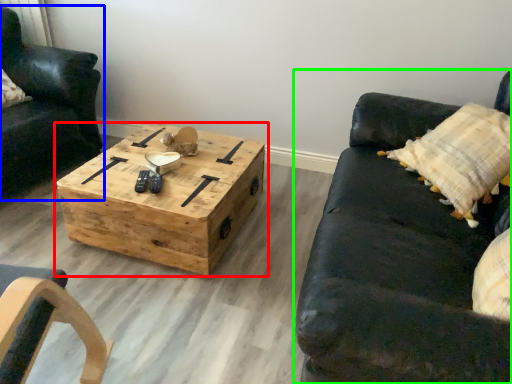
Question: Which object is positioned closest to coffee table (highlighted by a red box)? Select from chair (highlighted by a blue box) and studio couch (highlighted by a green box).

Choices:
 (A) chair
 (B) studio couch

Answer: (B)